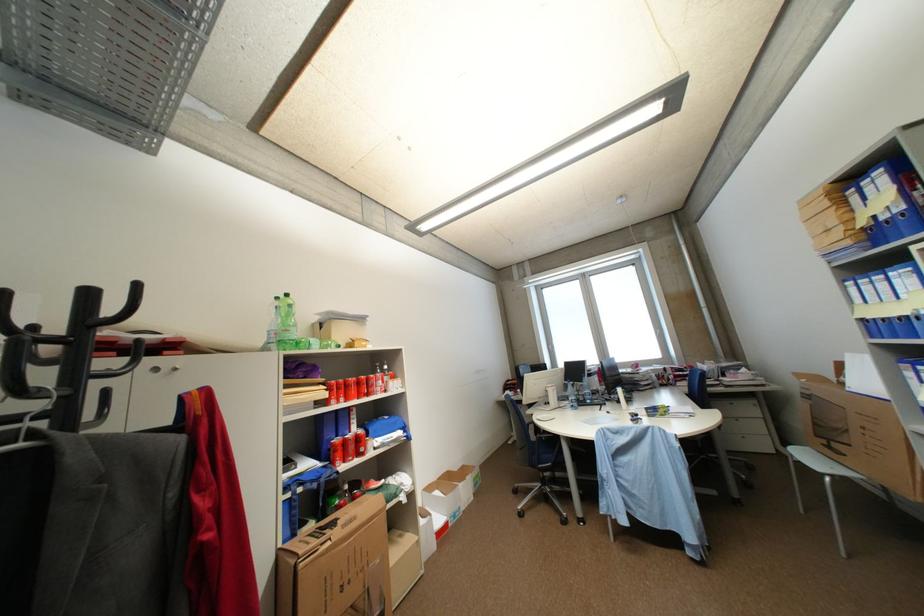
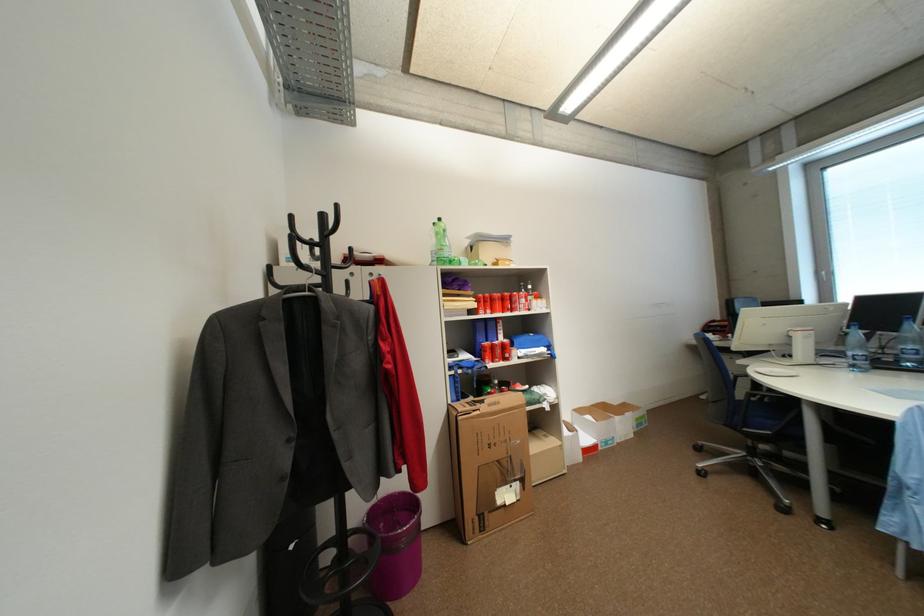
Locate, in the second image, the point that corresponds to pixel 589 394 in the first image.

(897, 352)